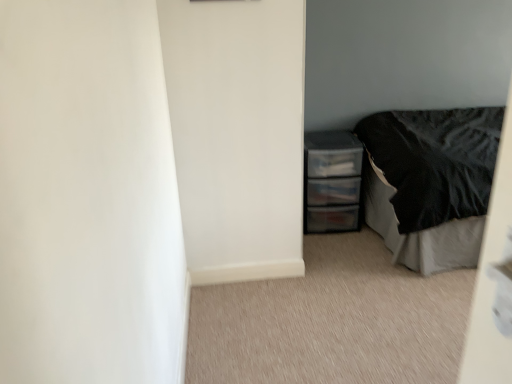
Question: Is black satin bed at right directly adjacent to clear plastic drawers at right?

Choices:
 (A) yes
 (B) no

Answer: (B)

Question: From a real-world perspective, is black satin bed at right below clear plastic drawers at right?

Choices:
 (A) yes
 (B) no

Answer: (B)

Question: Can you confirm if black satin bed at right is taller than clear plastic drawers at right?

Choices:
 (A) no
 (B) yes

Answer: (B)

Question: Considering the relative positions of black satin bed at right and clear plastic drawers at right in the image provided, is black satin bed at right to the right of clear plastic drawers at right from the viewer's perspective?

Choices:
 (A) no
 (B) yes

Answer: (B)

Question: Does black satin bed at right have a larger size compared to clear plastic drawers at right?

Choices:
 (A) yes
 (B) no

Answer: (A)

Question: From the image's perspective, is black satin bed at right beneath clear plastic drawers at right?

Choices:
 (A) yes
 (B) no

Answer: (B)

Question: Can you confirm if clear plastic drawers at right is positioned to the right of black satin bed at right?

Choices:
 (A) no
 (B) yes

Answer: (A)

Question: Is clear plastic drawers at right positioned with its back to black satin bed at right?

Choices:
 (A) no
 (B) yes

Answer: (A)

Question: Is clear plastic drawers at right not near black satin bed at right?

Choices:
 (A) no
 (B) yes

Answer: (A)

Question: Does clear plastic drawers at right have a lesser width compared to black satin bed at right?

Choices:
 (A) no
 (B) yes

Answer: (B)

Question: Does clear plastic drawers at right come behind black satin bed at right?

Choices:
 (A) no
 (B) yes

Answer: (B)

Question: From a real-world perspective, does clear plastic drawers at right sit lower than black satin bed at right?

Choices:
 (A) no
 (B) yes

Answer: (B)

Question: In the image, is black satin bed at right positioned in front of or behind clear plastic drawers at right?

Choices:
 (A) front
 (B) behind

Answer: (A)